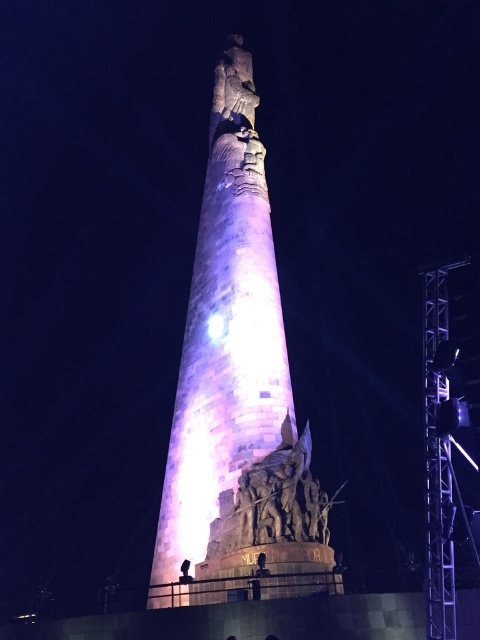
What is the spatial relationship between the purple stone tower at center and the stone sculpture at lower center in the image?

The purple stone tower at center is above the stone sculpture at lower center.

You are a construction worker standing at the base of the monument. You need to move a heavy tool from the stone sculpture at lower center to the metallic scaffolding at right. The tool requires a minimum of 10 meters of space to be moved safely. Can you move it directly without adjusting the current setup?

The stone sculpture at lower center is 9.90 meters away from the metallic scaffolding at right. Since the required minimum space is 10 meters, the distance is insufficient. Therefore, you cannot move the tool directly without adjusting the current setup.

What is the spatial relationship between the purple stone tower at center and the stone sculpture at lower center?

The purple stone tower at center is positioned on the left side of the stone sculpture at lower center.